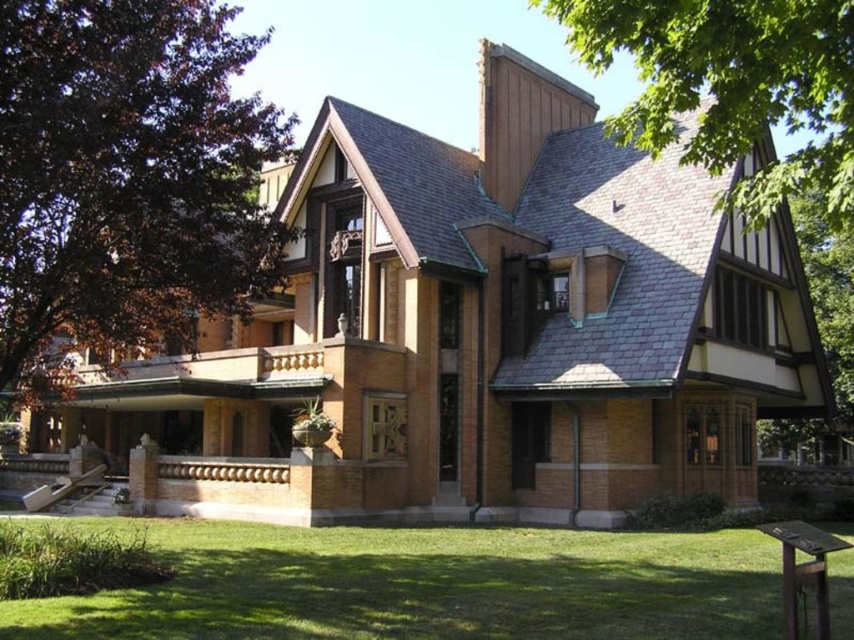
Question: Among these points, which one is nearest to the camera?

Choices:
 (A) (120, 326)
 (B) (624, 570)
 (C) (605, 33)

Answer: (C)

Question: Is dark brown wood at upper left wider than green leafy tree at upper right?

Choices:
 (A) no
 (B) yes

Answer: (A)

Question: Which is nearer to the green grass at lower center?

Choices:
 (A) dark brown wood at upper left
 (B) green leafy tree at upper right

Answer: (A)

Question: Does dark brown wood at upper left appear on the left side of green leafy tree at upper right?

Choices:
 (A) no
 (B) yes

Answer: (B)

Question: Which of the following is the farthest from the observer?

Choices:
 (A) dark brown wood at upper left
 (B) green leafy tree at upper right
 (C) green grass at lower center

Answer: (A)

Question: Where is dark brown wood at upper left located in relation to green grass at lower center in the image?

Choices:
 (A) left
 (B) right

Answer: (A)